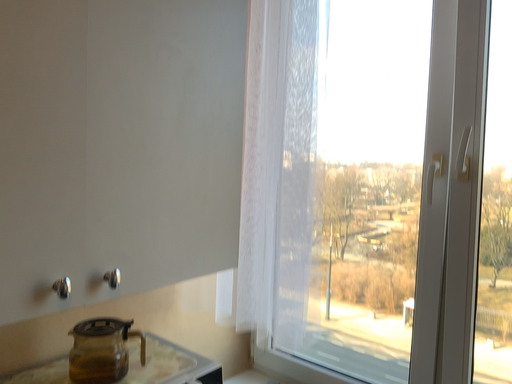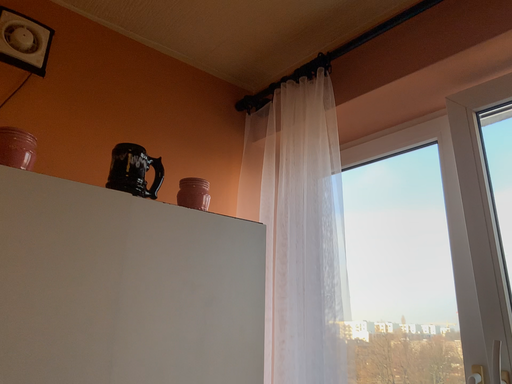
Question: How did the camera likely rotate when shooting the video?

Choices:
 (A) rotated right
 (B) rotated left

Answer: (B)